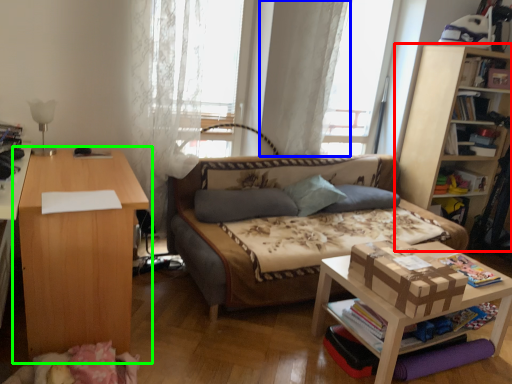
Question: Which object is positioned farthest from bookcase (highlighted by a red box)? Select from curtain (highlighted by a blue box) and table (highlighted by a green box).

Choices:
 (A) curtain
 (B) table

Answer: (B)